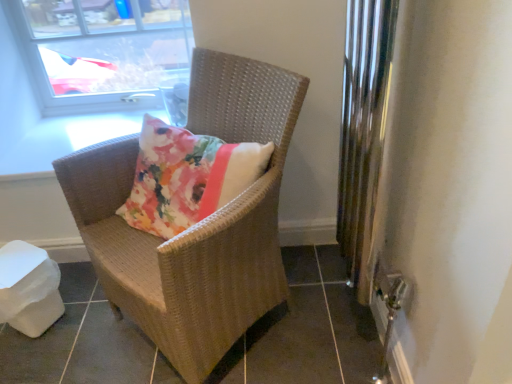
This screenshot has width=512, height=384. What do you see at coordinates (103, 50) in the screenshot?
I see `transparent glass window at upper left` at bounding box center [103, 50].

Locate an element on the screen. transparent glass window at upper left is located at coordinates (103, 50).

What is the approximate width of transparent glass window at upper left?

transparent glass window at upper left is 3.80 inches wide.

What do you see at coordinates (197, 225) in the screenshot?
I see `woven brown chair at center` at bounding box center [197, 225].

Where is `woven brown chair at center`? woven brown chair at center is located at coordinates (197, 225).

This screenshot has height=384, width=512. Find the location of `transparent glass window at upper left`. transparent glass window at upper left is located at coordinates (103, 50).

Can you confirm if transparent glass window at upper left is positioned to the left of woven brown chair at center?

Indeed, transparent glass window at upper left is positioned on the left side of woven brown chair at center.

From the picture: Considering the positions of objects transparent glass window at upper left and woven brown chair at center in the image provided, who is in front, transparent glass window at upper left or woven brown chair at center?

woven brown chair at center is closer to the camera.

Does point (182, 50) come farther from viewer compared to point (233, 101)?

Yes, point (182, 50) is behind point (233, 101).

Consider the image. From the image's perspective, who appears lower, transparent glass window at upper left or woven brown chair at center?

From the image's view, woven brown chair at center is below.

Based on the photo, from a real-world perspective, is transparent glass window at upper left physically located above or below woven brown chair at center?

From a real-world perspective, transparent glass window at upper left is physically above woven brown chair at center.

Is transparent glass window at upper left wider or thinner than woven brown chair at center?

transparent glass window at upper left is thinner than woven brown chair at center.

Based on the photo, between transparent glass window at upper left and woven brown chair at center, which one has more height?

woven brown chair at center.

In the scene shown: Does transparent glass window at upper left have a larger size compared to woven brown chair at center?

No, transparent glass window at upper left is not bigger than woven brown chair at center.

Is transparent glass window at upper left spatially inside woven brown chair at center, or outside of it?

transparent glass window at upper left is outside woven brown chair at center.

Is transparent glass window at upper left not close to woven brown chair at center?

They are positioned close to each other.

Is transparent glass window at upper left aimed at woven brown chair at center?

Yes, transparent glass window at upper left is turned towards woven brown chair at center.

From the picture: How different are the orientations of transparent glass window at upper left and woven brown chair at center in degrees?

The angular difference between transparent glass window at upper left and woven brown chair at center is 46.4 degrees.

How distant is transparent glass window at upper left from woven brown chair at center?

transparent glass window at upper left and woven brown chair at center are 30.14 inches apart from each other.

This screenshot has width=512, height=384. I want to click on chair below the transparent glass window at upper left (from the image's perspective), so click(x=197, y=225).

Can you confirm if woven brown chair at center is positioned to the left of transparent glass window at upper left?

No.

Which object is closer to the camera, woven brown chair at center or transparent glass window at upper left?

Positioned in front is woven brown chair at center.

Does point (244, 306) appear closer or farther from the camera than point (58, 53)?

Point (244, 306).

From the image's perspective, who appears lower, woven brown chair at center or transparent glass window at upper left?

woven brown chair at center appears lower in the image.

From a real-world perspective, who is located higher, woven brown chair at center or transparent glass window at upper left?

From a 3D spatial view, transparent glass window at upper left is above.

Is woven brown chair at center thinner than transparent glass window at upper left?

No.

Which of these two, woven brown chair at center or transparent glass window at upper left, stands taller?

woven brown chair at center.

Which of these two, woven brown chair at center or transparent glass window at upper left, is bigger?

With larger size is woven brown chair at center.

Is woven brown chair at center inside or outside of transparent glass window at upper left?

woven brown chair at center exists outside the volume of transparent glass window at upper left.

Based on the photo, are woven brown chair at center and transparent glass window at upper left making contact?

woven brown chair at center is not next to transparent glass window at upper left, and they're not touching.

Based on the photo, is transparent glass window at upper left at the back of woven brown chair at center?

No, woven brown chair at center is not facing away from transparent glass window at upper left.

You are a GUI agent. You are given a task and a screenshot of the screen. Output one action in this format:
    pyautogui.click(x=<x>, y=<y>)
    Task: Click on the chair below the transparent glass window at upper left (from the image's perspective)
    The image size is (512, 384).
    Given the screenshot: What is the action you would take?
    pyautogui.click(x=197, y=225)

I want to click on window behind the woven brown chair at center, so click(103, 50).

This screenshot has width=512, height=384. Identify the location of chair below the transparent glass window at upper left (from the image's perspective). (197, 225).